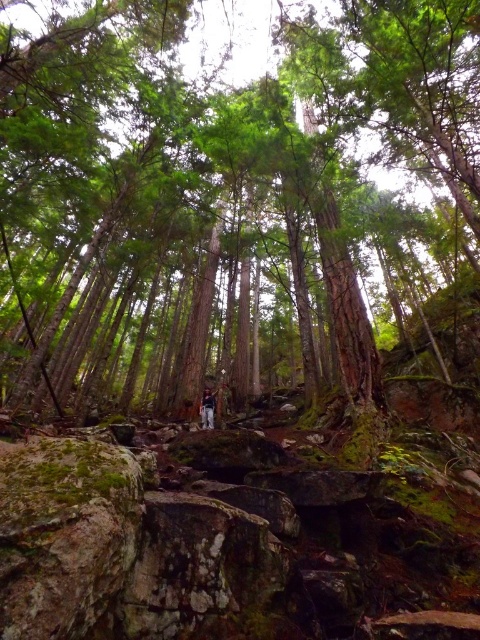
Question: Can you confirm if green rough bark tree at center is bigger than dark blue jeans at center?

Choices:
 (A) no
 (B) yes

Answer: (B)

Question: Can you confirm if green rough bark tree at center is thinner than dark blue jeans at center?

Choices:
 (A) no
 (B) yes

Answer: (A)

Question: Which object appears closest to the camera in this image?

Choices:
 (A) green rough bark tree at center
 (B) dark blue jeans at center

Answer: (A)

Question: Which point is closer to the camera taking this photo?

Choices:
 (A) (212, 422)
 (B) (23, 349)

Answer: (A)

Question: Which point is farther to the camera?

Choices:
 (A) green rough bark tree at center
 (B) dark blue jeans at center

Answer: (B)

Question: Is green rough bark tree at center above dark blue jeans at center?

Choices:
 (A) no
 (B) yes

Answer: (B)